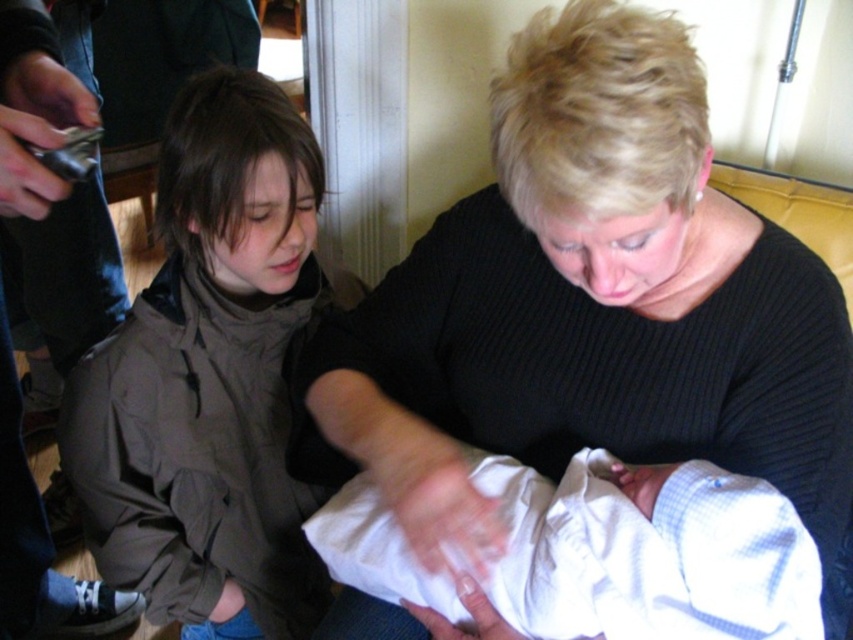
Question: Which object is positioned closest to the white soft cloth at center?

Choices:
 (A) brown matte jacket at left
 (B) black ribbed sweater at center

Answer: (B)

Question: Does brown matte jacket at left have a smaller size compared to white soft cloth at center?

Choices:
 (A) yes
 (B) no

Answer: (B)

Question: Is brown matte jacket at left further to the viewer compared to white soft cloth at center?

Choices:
 (A) no
 (B) yes

Answer: (B)

Question: Which object appears farthest from the camera in this image?

Choices:
 (A) black ribbed sweater at center
 (B) brown matte jacket at left
 (C) white soft cloth at center

Answer: (B)

Question: Based on their relative distances, which object is farther from the brown matte jacket at left?

Choices:
 (A) black ribbed sweater at center
 (B) white soft cloth at center

Answer: (B)

Question: Is black ribbed sweater at center wider than brown matte jacket at left?

Choices:
 (A) yes
 (B) no

Answer: (A)